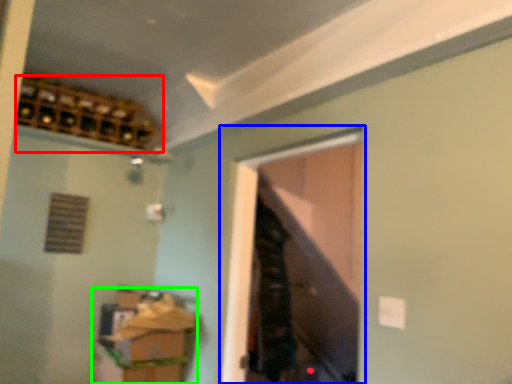
Question: Estimate the real-world distances between objects in this image. Which object is closer to wine cabinet (highlighted by a red box), window (highlighted by a blue box) or cabinetry (highlighted by a green box)?

Choices:
 (A) window
 (B) cabinetry

Answer: (B)